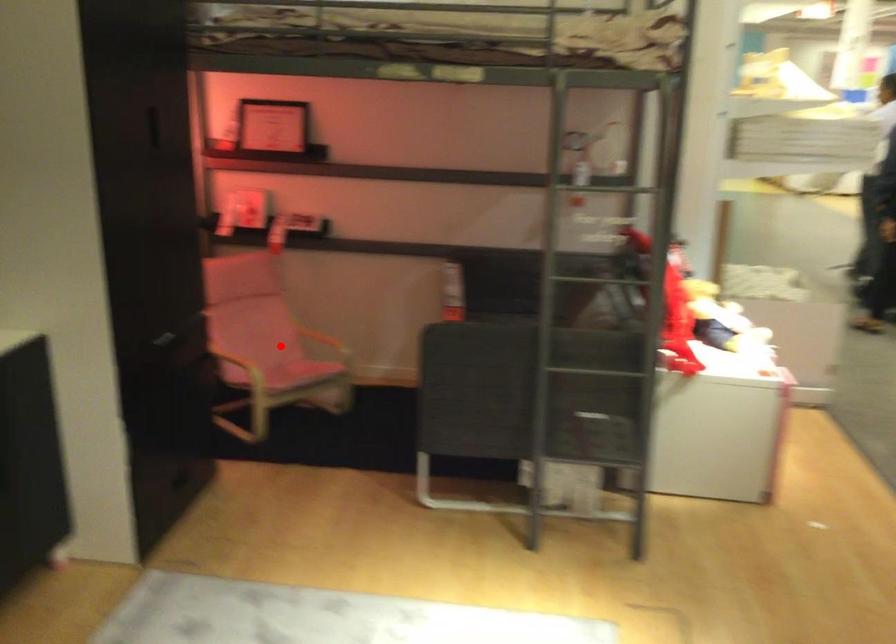
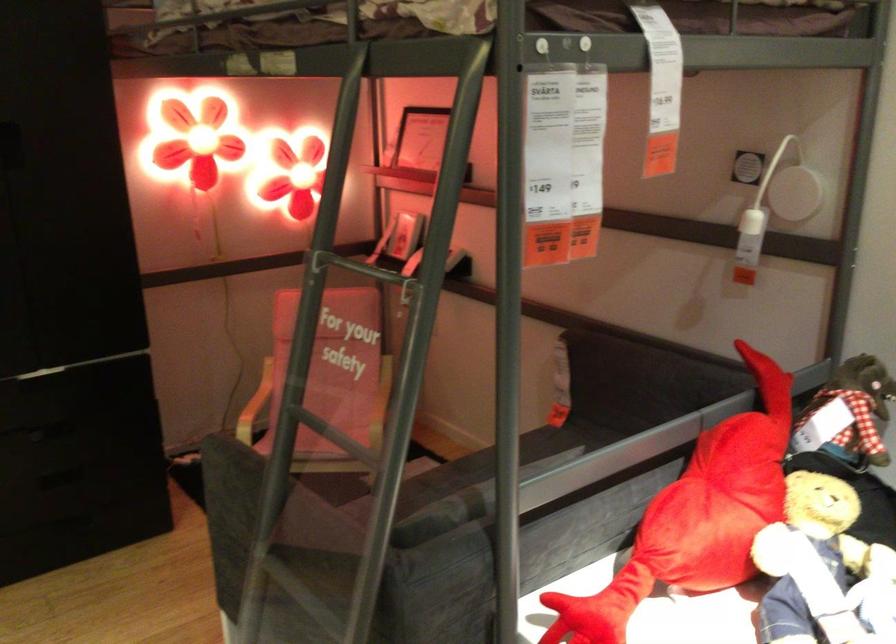
Locate, in the second image, the point that corresponds to the highlighted location in the first image.

(331, 404)